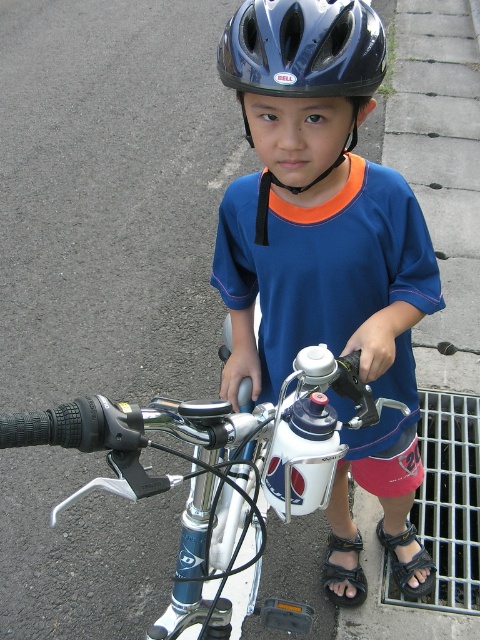
Question: Observing the image, what is the correct spatial positioning of black leather sandal at lower right in reference to black leather sandal at lower center?

Choices:
 (A) above
 (B) below

Answer: (A)

Question: Which object appears farthest from the camera in this image?

Choices:
 (A) black matte helmet at upper center
 (B) black matte helmet at center
 (C) black leather sandal at lower right

Answer: (C)

Question: Based on their relative distances, which object is nearer to the black leather sandal at lower right?

Choices:
 (A) blue matte helmet at upper center
 (B) black matte helmet at center

Answer: (A)

Question: In this image, where is white metallic bicycle at center located relative to black matte helmet at center?

Choices:
 (A) above
 (B) below

Answer: (B)

Question: Which of these objects is positioned closest to the black matte helmet at center?

Choices:
 (A) white metallic bicycle at center
 (B) black matte helmet at upper center
 (C) black leather sandal at lower right

Answer: (B)

Question: Does blue matte helmet at upper center appear on the right side of black matte helmet at center?

Choices:
 (A) yes
 (B) no

Answer: (A)